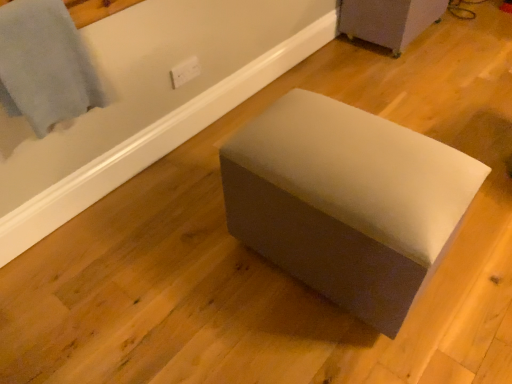
Image resolution: width=512 pixels, height=384 pixels. Find the location of `blank space above suede-like gray ottoman at center (from a real-world perspective)`. blank space above suede-like gray ottoman at center (from a real-world perspective) is located at coordinates (205, 91).